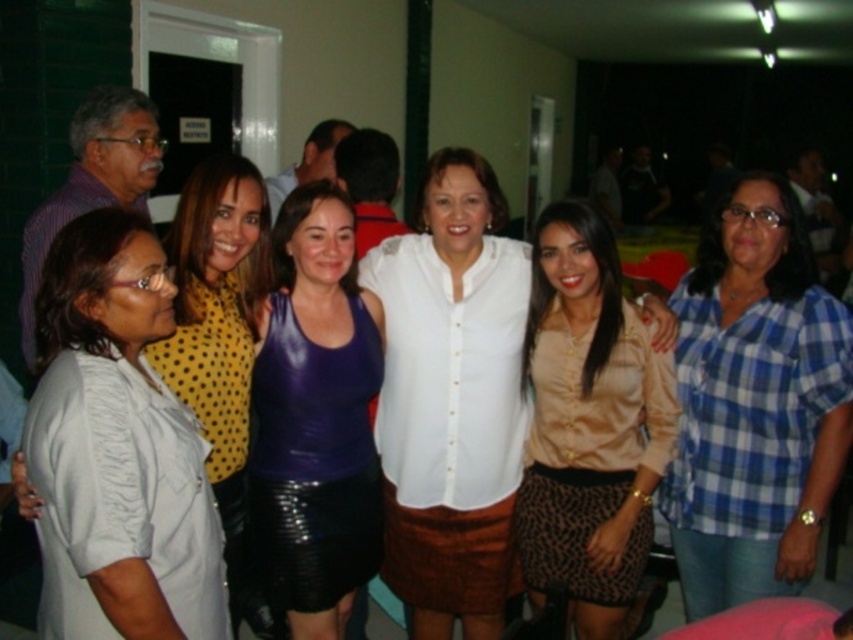
Question: In this image, where is brown satin blouse at center located relative to white satin blouse at center?

Choices:
 (A) above
 (B) below

Answer: (B)

Question: Is white button-up shirt at center below yellow dotted blouse at upper left?

Choices:
 (A) no
 (B) yes

Answer: (A)

Question: Is white satin blouse at left wider than brown satin blouse at center?

Choices:
 (A) yes
 (B) no

Answer: (B)

Question: Estimate the real-world distances between objects in this image. Which object is closer to the blue plaid shirt at right?

Choices:
 (A) yellow dotted blouse at upper left
 (B) purple shiny tank top at center

Answer: (B)

Question: Which object is farther from the camera taking this photo?

Choices:
 (A) white button-up shirt at center
 (B) blue plaid shirt at right
 (C) yellow dotted blouse at upper left
 (D) brown satin blouse at center

Answer: (A)

Question: Which point is farther to the camera?

Choices:
 (A) white button-up shirt at center
 (B) white satin blouse at left
 (C) purple shiny tank top at center

Answer: (A)